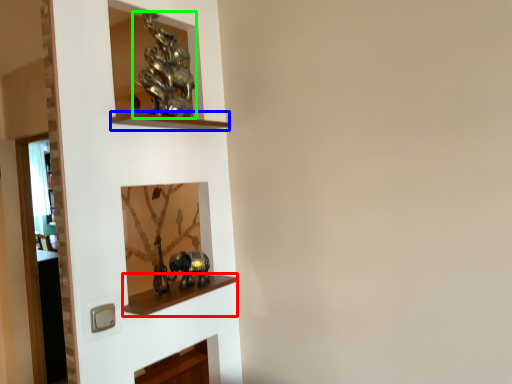
Question: Estimate the real-world distances between objects in this image. Which object is farther from cabinet (highlighted by a red box), cabinet (highlighted by a blue box) or art (highlighted by a green box)?

Choices:
 (A) cabinet
 (B) art

Answer: (B)